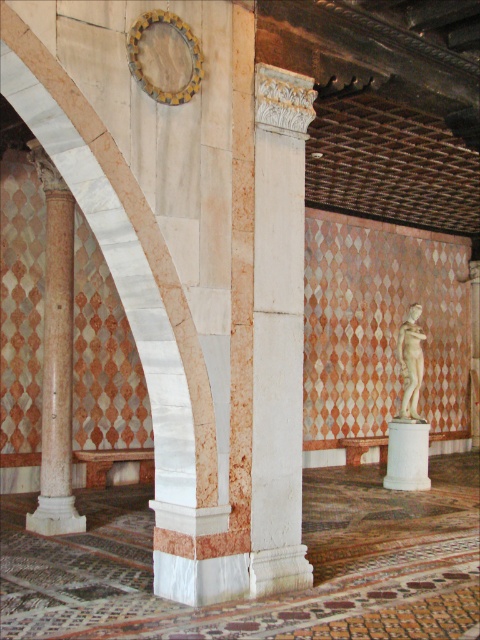
Question: Among these objects, which one is nearest to the camera?

Choices:
 (A) white marble column at center
 (B) white marble statue at center

Answer: (A)

Question: Among these objects, which one is farthest from the camera?

Choices:
 (A) white marble column at center
 (B) marble column at left

Answer: (B)

Question: Which of the following is the closest to the observer?

Choices:
 (A) marble column at left
 (B) white marble statue at center

Answer: (A)

Question: Is white marble column at center wider than marble column at left?

Choices:
 (A) no
 (B) yes

Answer: (A)

Question: Can you confirm if white marble column at center is positioned to the left of white marble statue at center?

Choices:
 (A) no
 (B) yes

Answer: (B)

Question: Does white marble column at center appear on the right side of marble column at left?

Choices:
 (A) no
 (B) yes

Answer: (B)